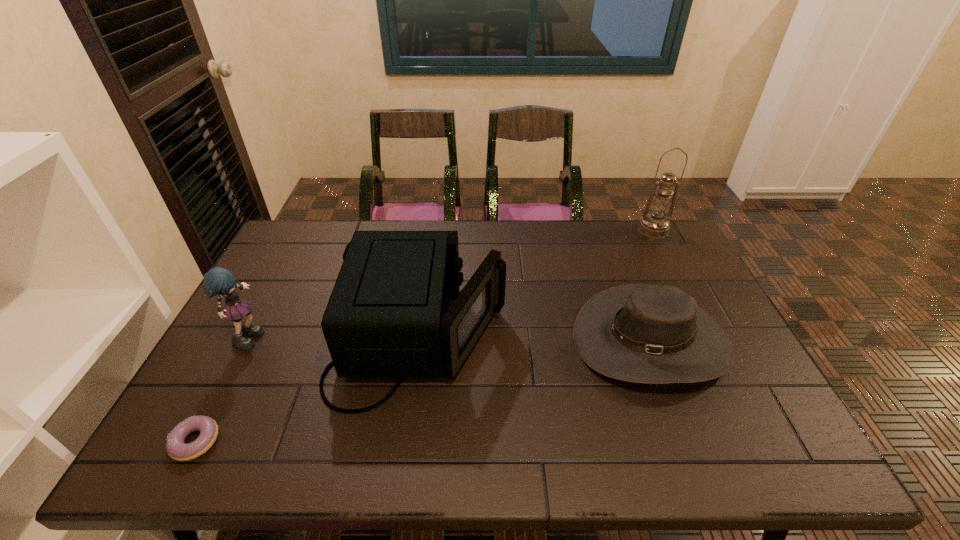
The height and width of the screenshot is (540, 960). Find the location of `free space located with the door open on the third object from right to left`. free space located with the door open on the third object from right to left is located at coordinates (582, 338).

What are the coordinates of `free space located 0.070m on the front-facing side of the cowboy hat` in the screenshot? It's located at (681, 423).

The height and width of the screenshot is (540, 960). What are the coordinates of `vacant space located on the right of the shortest object` in the screenshot? It's located at (345, 442).

The image size is (960, 540). What are the coordinates of `object that is positioned at the far edge` in the screenshot? It's located at (655, 225).

This screenshot has width=960, height=540. In order to click on object present at the near edge in this screenshot , I will do `click(176, 448)`.

You are a GUI agent. You are given a task and a screenshot of the screen. Output one action in this format:
    pyautogui.click(x=<x>, y=<y>)
    Task: Click on the rag doll that is at the left edge
    The width and height of the screenshot is (960, 540).
    Given the screenshot: What is the action you would take?
    pyautogui.click(x=221, y=281)

Find the location of a particular element. The image size is (960, 540). doughnut at the left edge is located at coordinates (176, 448).

The width and height of the screenshot is (960, 540). I want to click on oil lamp situated at the right edge, so click(x=655, y=225).

Image resolution: width=960 pixels, height=540 pixels. Find the location of `cowboy hat present at the right edge`. cowboy hat present at the right edge is located at coordinates (640, 333).

Locate an element on the screen. object located in the near left corner section of the desktop is located at coordinates (176, 448).